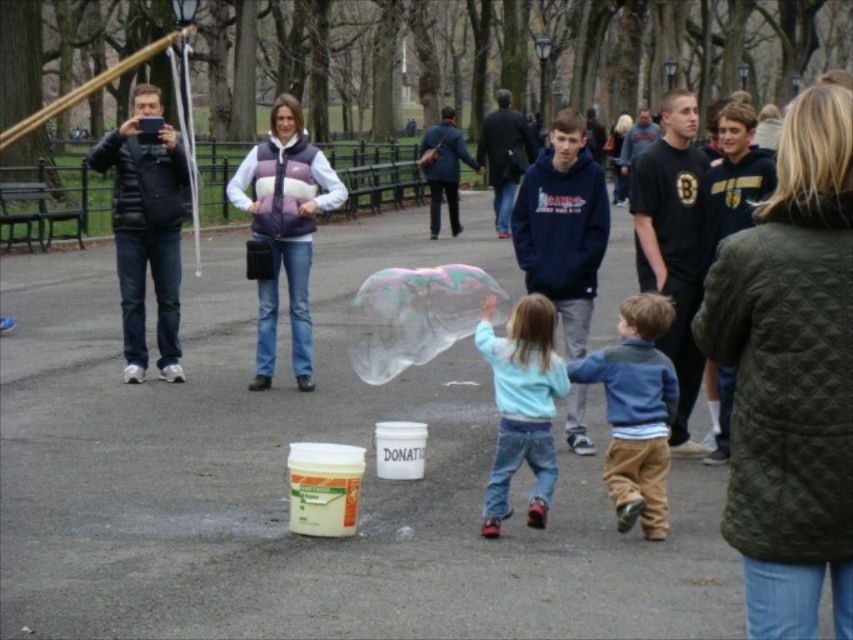
Is black cotton t-shirt at right further to camera compared to blue fleece jacket at center?

Yes, black cotton t-shirt at right is behind blue fleece jacket at center.

Between point (689, 355) and point (648, 461), which one is positioned in front?

Positioned in front is point (648, 461).

Find the location of a particular element. The width and height of the screenshot is (853, 640). black cotton t-shirt at right is located at coordinates (672, 243).

Is black cotton t-shirt at right further to camera compared to light blue fleece at center?

Yes.

The height and width of the screenshot is (640, 853). Describe the element at coordinates (672, 243) in the screenshot. I see `black cotton t-shirt at right` at that location.

This screenshot has height=640, width=853. Identify the location of black cotton t-shirt at right. (672, 243).

Is blue fleece jacket at center behind light blue fleece at center?

No.

Which is more to the left, blue fleece jacket at center or light blue fleece at center?

From the viewer's perspective, light blue fleece at center appears more on the left side.

You are a GUI agent. You are given a task and a screenshot of the screen. Output one action in this format:
    pyautogui.click(x=<x>, y=<y>)
    Task: Click on the blue fleece jacket at center
    The width and height of the screenshot is (853, 640).
    Given the screenshot: What is the action you would take?
    pyautogui.click(x=636, y=412)